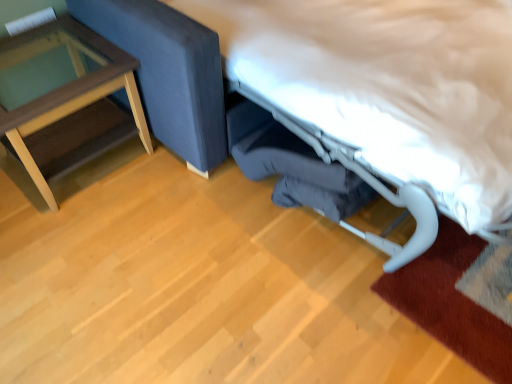
Locate an element on the screen. The width and height of the screenshot is (512, 384). vacant area that is in front of transparent glass table at left is located at coordinates (90, 246).